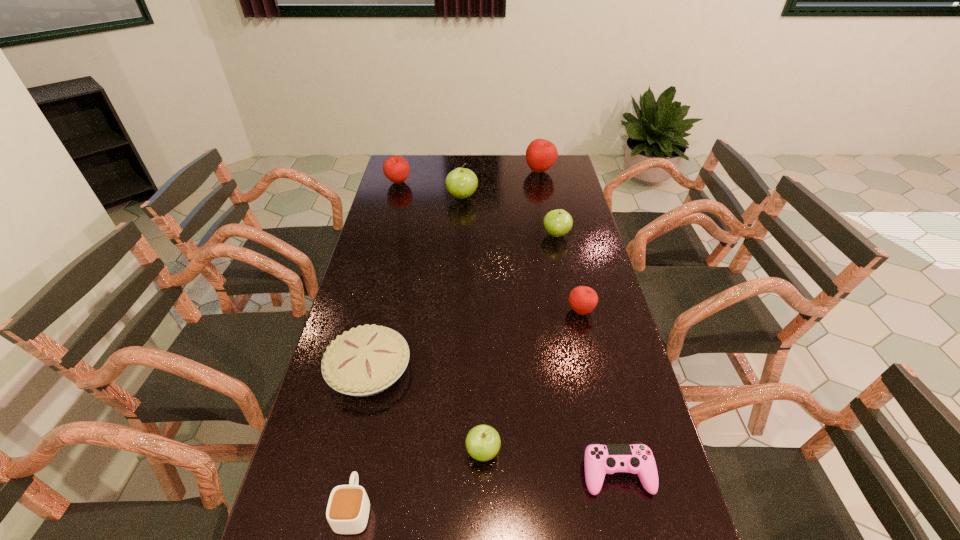
Locate an element on the screen. This screenshot has width=960, height=540. blank area at the far edge is located at coordinates (447, 172).

Where is `free space at the left edge`? This screenshot has width=960, height=540. free space at the left edge is located at coordinates (348, 408).

In the image, there is a desktop. What are the coordinates of `vacant space at the right edge` in the screenshot? It's located at (567, 201).

Locate an element on the screen. The image size is (960, 540). vacant space at the far left corner of the desktop is located at coordinates (418, 170).

At what (x,y) coordinates should I click in order to perform the action: click on vacant region between the smallest green apple and the cup. Please return your answer as a coordinate pair (x, y). This screenshot has width=960, height=540. Looking at the image, I should click on (419, 480).

I want to click on free space between the pie and the smallest red apple, so click(x=475, y=340).

The height and width of the screenshot is (540, 960). What are the coordinates of `empty space between the nearest apple and the farthest green apple` in the screenshot? It's located at (472, 325).

In order to click on vacant point located between the second farthest green apple and the white cup in this screenshot , I will do `click(455, 371)`.

The width and height of the screenshot is (960, 540). I want to click on vacant area that lies between the biggest red apple and the control, so click(579, 322).

The width and height of the screenshot is (960, 540). I want to click on free space between the fourth nearest object and the leftmost apple, so click(x=384, y=276).